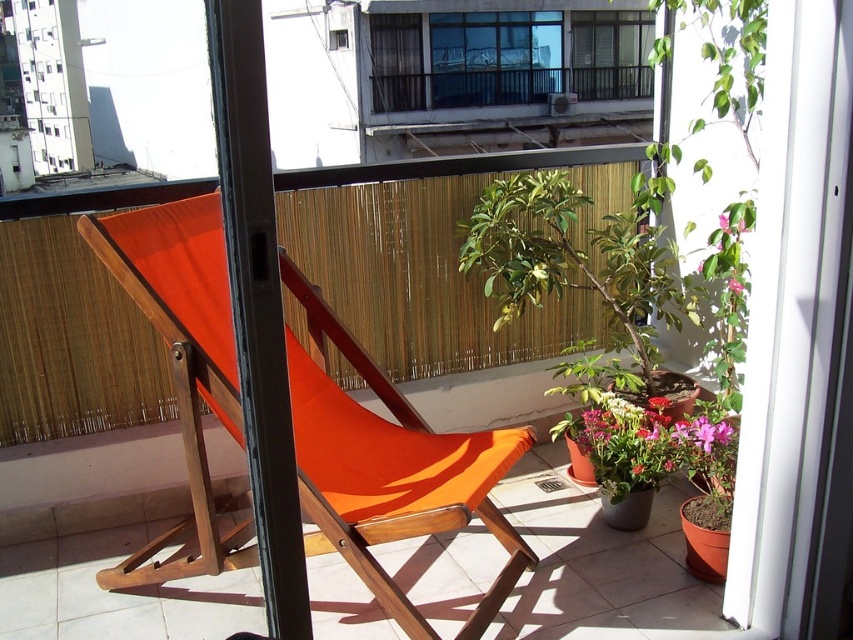
You are a window installer checking the balcony. You have two types of glass panes available, one is larger and one is smaller. The transparent glass window at upper center needs replacement. Which pane should you choose based on the existing clear glass window at upper center?

The transparent glass window at upper center has a larger size compared to the clear glass window at upper center, so you should choose the larger pane for replacement.

You are standing on the balcony and want to see the view through the transparent glass window at upper center. Where should you look to see it?

The transparent glass window at upper center is located at point (x=494, y=58), so you should look towards the upper center area of the balcony to see it.